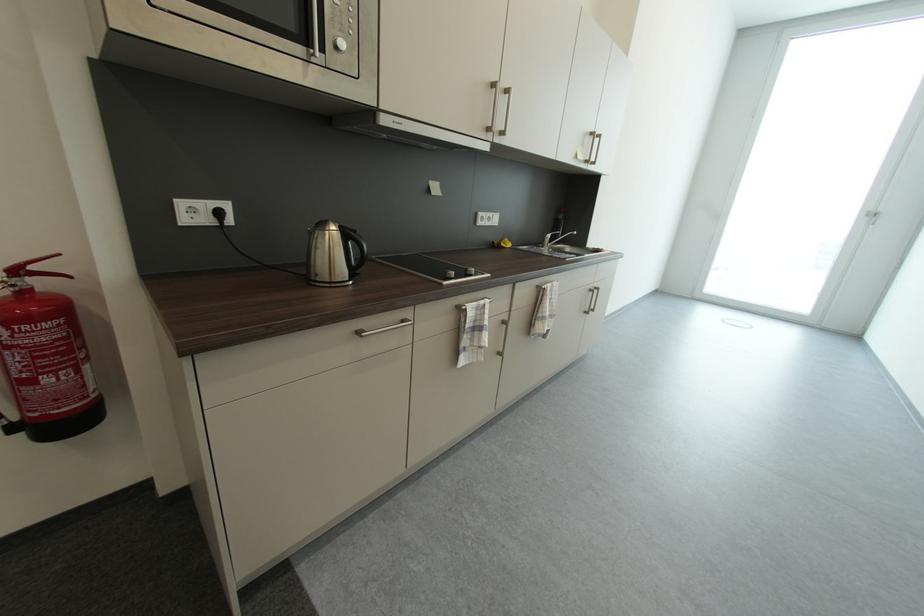
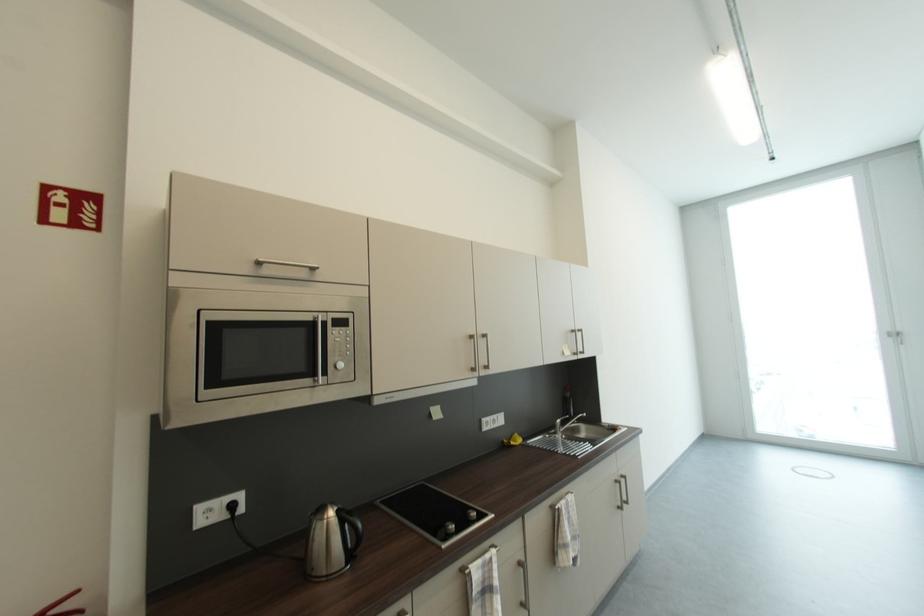
The images are taken continuously from a first-person perspective. In which direction are you moving?

The movement direction of the cameraman is right, backward.